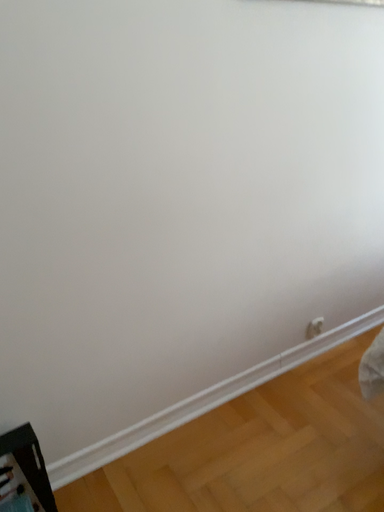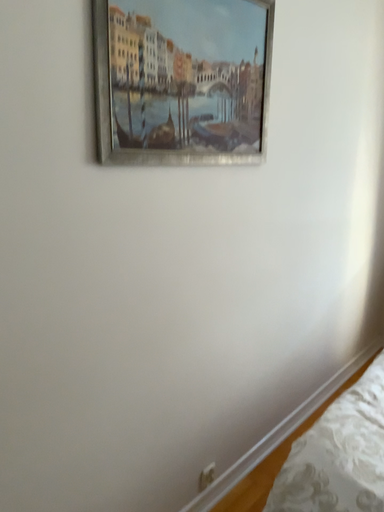
Question: How did the camera likely rotate when shooting the video?

Choices:
 (A) rotated right
 (B) rotated left

Answer: (A)